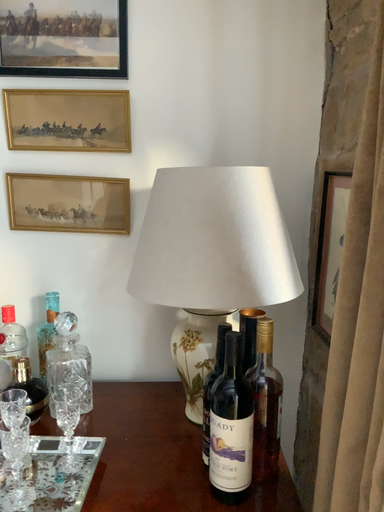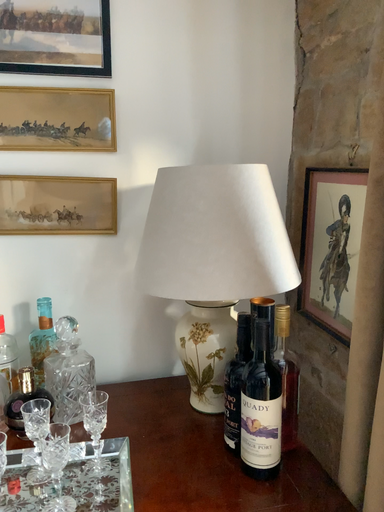
Question: How did the camera likely rotate when shooting the video?

Choices:
 (A) rotated right
 (B) rotated left

Answer: (A)